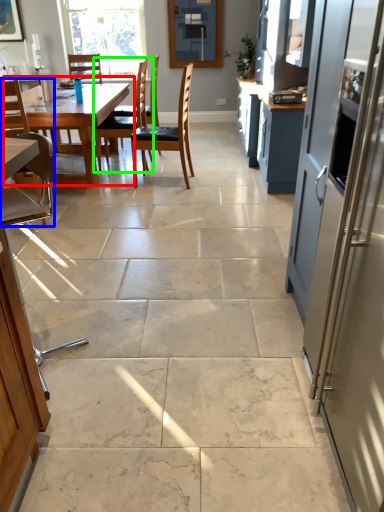
Question: Considering the real-world distances, which object is farthest from kitchen & dining room table (highlighted by a red box)? chair (highlighted by a blue box) or chair (highlighted by a green box)?

Choices:
 (A) chair
 (B) chair

Answer: (B)